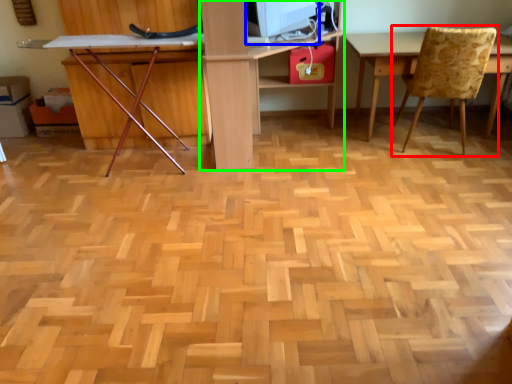
Question: Based on their relative distances, which object is nearer to chair (highlighted by a red box)? Choose from computer monitor (highlighted by a blue box) and computer desk (highlighted by a green box).

Choices:
 (A) computer monitor
 (B) computer desk

Answer: (A)